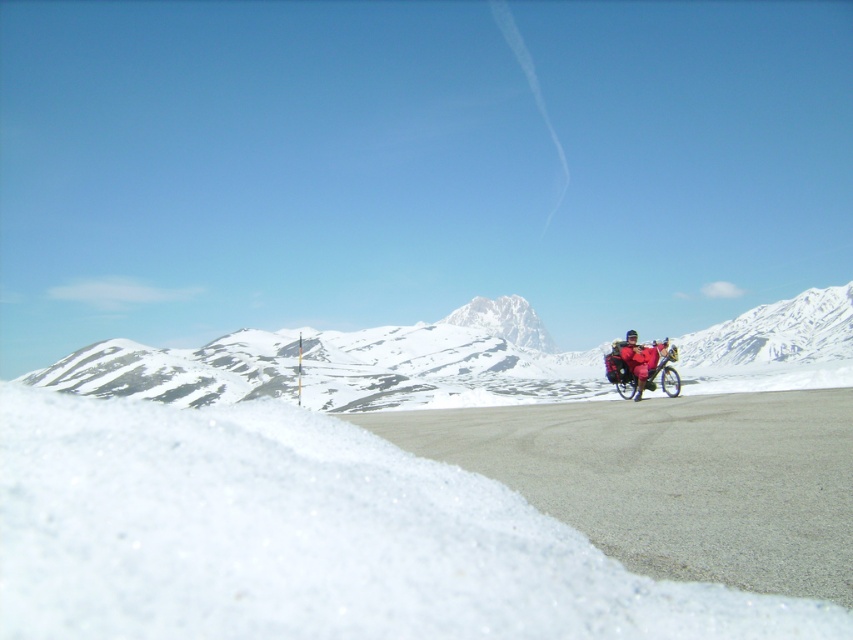
Which of these two, snowy white mountain at right or red fabric jacket at right, stands taller?

snowy white mountain at right is taller.

Where is `snowy white mountain at right`? Image resolution: width=853 pixels, height=640 pixels. snowy white mountain at right is located at coordinates (776, 332).

Where is `snowy white mountain at right`? The image size is (853, 640). snowy white mountain at right is located at coordinates (776, 332).

Does snowy white mountain at right have a greater height compared to white snow-covered mountain at center?

Indeed, snowy white mountain at right has a greater height compared to white snow-covered mountain at center.

Describe the element at coordinates (776, 332) in the screenshot. The image size is (853, 640). I see `snowy white mountain at right` at that location.

Is point (811, 321) farther from camera compared to point (521, 298)?

No, it is in front of (521, 298).

Image resolution: width=853 pixels, height=640 pixels. What are the coordinates of `snowy white mountain at right` in the screenshot? It's located at (776, 332).

Is white powdery snow at lower left shorter than white snow-covered mountain at upper center?

Correct, white powdery snow at lower left is not as tall as white snow-covered mountain at upper center.

Is white powdery snow at lower left taller than white snow-covered mountain at upper center?

No, white powdery snow at lower left is not taller than white snow-covered mountain at upper center.

Where is `white powdery snow at lower left`? white powdery snow at lower left is located at coordinates (305, 538).

You are a GUI agent. You are given a task and a screenshot of the screen. Output one action in this format:
    pyautogui.click(x=<x>, y=<y>)
    Task: Click on the white powdery snow at lower left
    Image resolution: width=853 pixels, height=640 pixels.
    Given the screenshot: What is the action you would take?
    pyautogui.click(x=305, y=538)